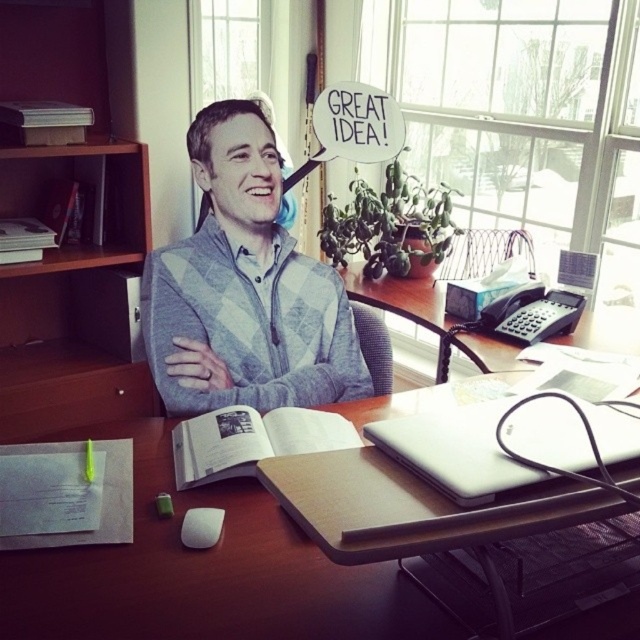
Which is below, gray checkered sweater at center or white paper book at center?

white paper book at center is below.

Locate an element on the screen. This screenshot has height=640, width=640. gray checkered sweater at center is located at coordinates (244, 289).

Who is positioned more to the left, gray checkered sweater at center or white matte laptop at center?

gray checkered sweater at center is more to the left.

Image resolution: width=640 pixels, height=640 pixels. What are the coordinates of `gray checkered sweater at center` in the screenshot? It's located at pos(244,289).

Between point (156, 348) and point (376, 435), which one is positioned in front?

Point (376, 435) is more forward.

Where is `gray checkered sweater at center`? gray checkered sweater at center is located at coordinates (244, 289).

Measure the distance between wooden desk at center and white matte laptop at center.

wooden desk at center is 8.70 inches away from white matte laptop at center.

Is wooden desk at center thinner than white matte laptop at center?

No, wooden desk at center is not thinner than white matte laptop at center.

You are a GUI agent. You are given a task and a screenshot of the screen. Output one action in this format:
    pyautogui.click(x=<x>, y=<y>)
    Task: Click on the wooden desk at center
    The width and height of the screenshot is (640, 640).
    Given the screenshot: What is the action you would take?
    pyautogui.click(x=205, y=572)